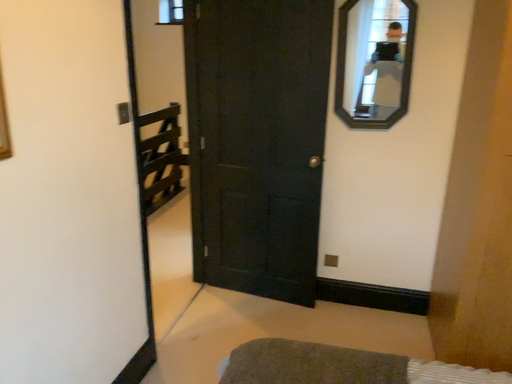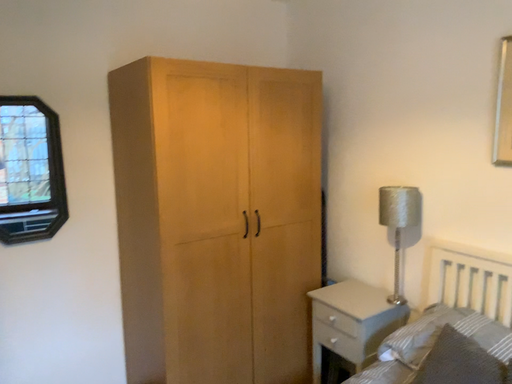
Question: How did the camera likely rotate when shooting the video?

Choices:
 (A) rotated upward
 (B) rotated downward

Answer: (A)